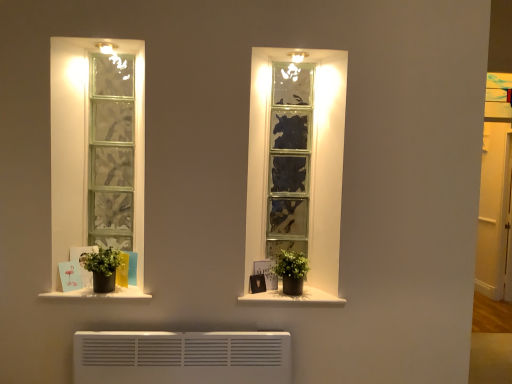
You are a GUI agent. You are given a task and a screenshot of the screen. Output one action in this format:
    pyautogui.click(x=<x>, y=<y>)
    Task: Click on the free space below green matte plant at right, which appears as the second houseplant when viewed from the left (from a real-world perspective)
    This screenshot has width=512, height=384.
    Given the screenshot: What is the action you would take?
    pyautogui.click(x=291, y=301)